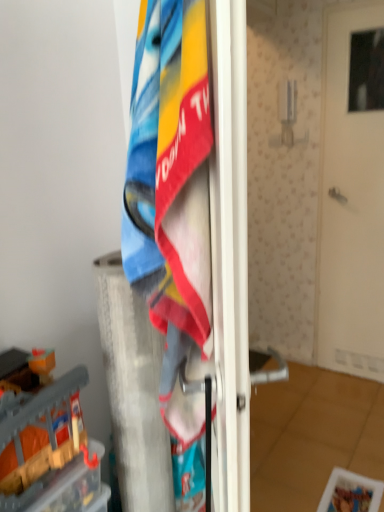
Question: Is textured cotton towel at center oriented towards white textured pillar at center?

Choices:
 (A) yes
 (B) no

Answer: (B)

Question: Is white textured pillar at center at the back of textured cotton towel at center?

Choices:
 (A) no
 (B) yes

Answer: (A)

Question: Considering the relative positions of textured cotton towel at center and white textured pillar at center in the image provided, is textured cotton towel at center in front of white textured pillar at center?

Choices:
 (A) yes
 (B) no

Answer: (A)

Question: Does textured cotton towel at center have a larger size compared to white textured pillar at center?

Choices:
 (A) no
 (B) yes

Answer: (A)

Question: Does textured cotton towel at center have a lesser width compared to white textured pillar at center?

Choices:
 (A) no
 (B) yes

Answer: (B)

Question: From the image's perspective, is white matte door at center positioned above or below textured cotton towel at center?

Choices:
 (A) above
 (B) below

Answer: (A)

Question: Is white matte door at center to the left or to the right of textured cotton towel at center in the image?

Choices:
 (A) left
 (B) right

Answer: (B)

Question: Is point (340, 112) positioned closer to the camera than point (135, 125)?

Choices:
 (A) closer
 (B) farther

Answer: (B)

Question: Is white matte door at center situated inside textured cotton towel at center or outside?

Choices:
 (A) outside
 (B) inside

Answer: (A)

Question: From the image's perspective, is white textured pillar at center located above or below white matte door at center?

Choices:
 (A) above
 (B) below

Answer: (B)

Question: In terms of height, does white textured pillar at center look taller or shorter compared to white matte door at center?

Choices:
 (A) tall
 (B) short

Answer: (B)

Question: Would you say white textured pillar at center is inside or outside white matte door at center?

Choices:
 (A) inside
 (B) outside

Answer: (B)

Question: From a real-world perspective, relative to white matte door at center, is white textured pillar at center vertically above or below?

Choices:
 (A) below
 (B) above

Answer: (A)

Question: Choose the correct answer: Is white matte door at center inside white textured pillar at center or outside it?

Choices:
 (A) outside
 (B) inside

Answer: (A)

Question: In terms of width, does white matte door at center look wider or thinner when compared to white textured pillar at center?

Choices:
 (A) thin
 (B) wide

Answer: (A)